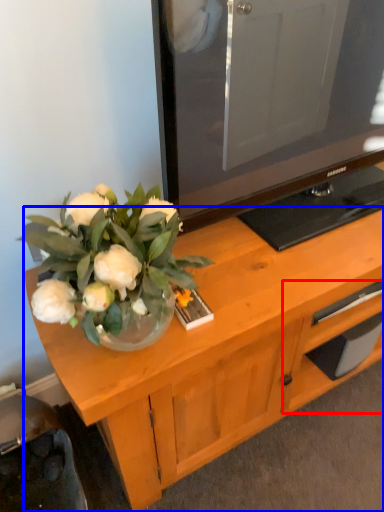
Question: Which object is further to the camera taking this photo, drawer (highlighted by a red box) or desk (highlighted by a blue box)?

Choices:
 (A) drawer
 (B) desk

Answer: (A)